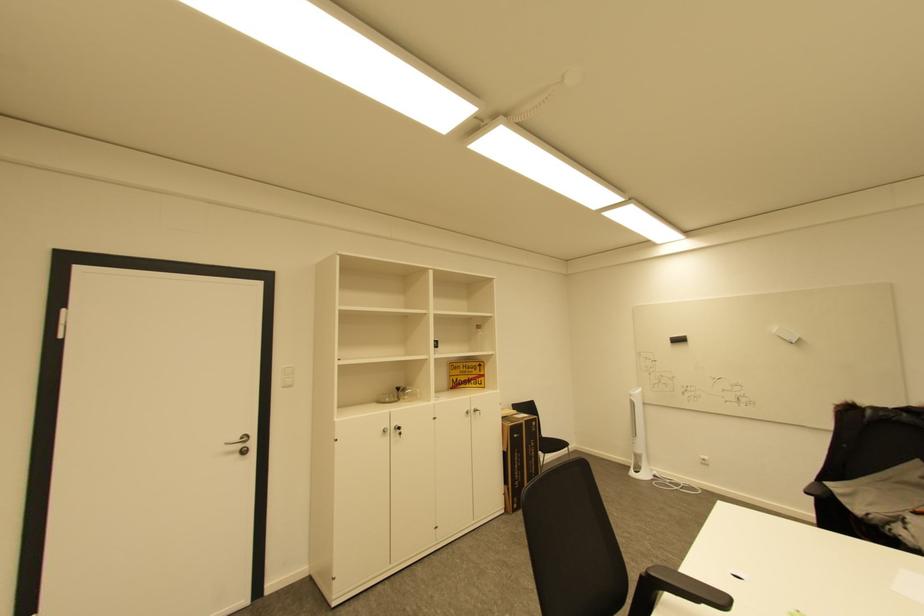
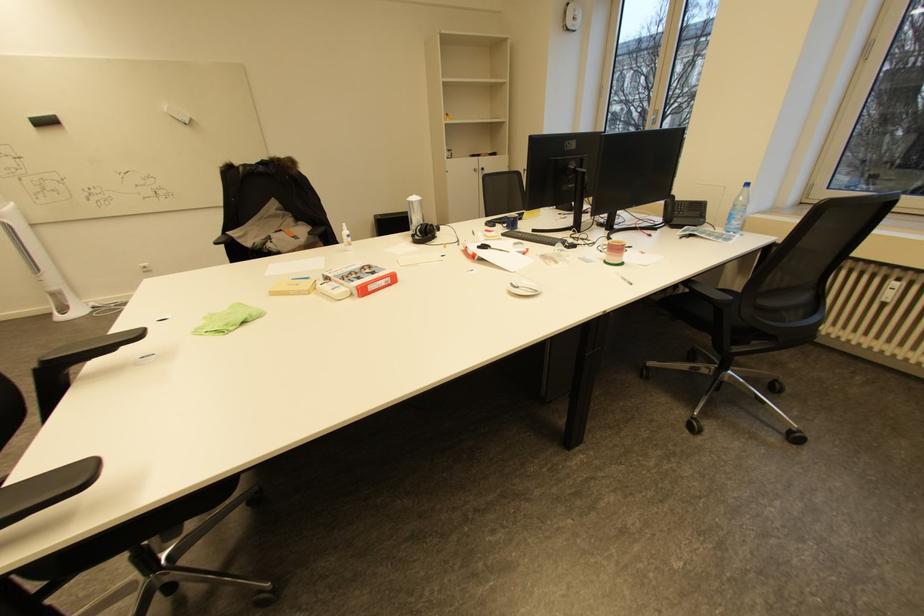
Consider the image. The first image is from the beginning of the video and the second image is from the end. How did the camera likely rotate when shooting the video?

The camera's rotation is toward right-down.